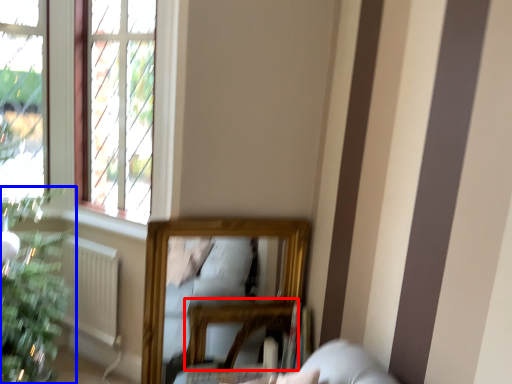
Question: Which of the following is the farthest to the observer, table (highlighted by a red box) or houseplant (highlighted by a blue box)?

Choices:
 (A) table
 (B) houseplant

Answer: (B)